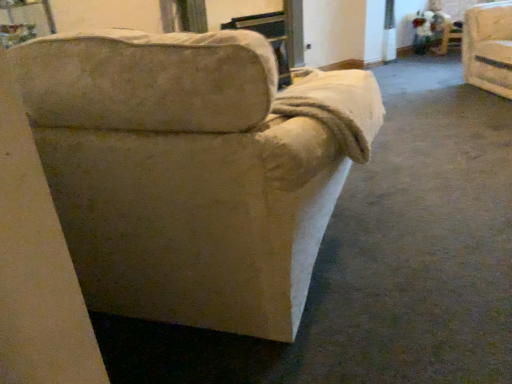
Question: Should I look upward or downward to see beige fabric couch at center?

Choices:
 (A) up
 (B) down

Answer: (A)